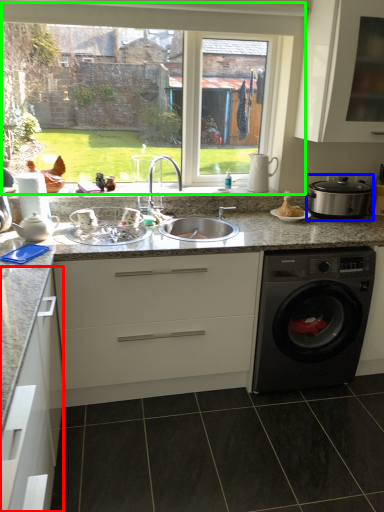
Question: Estimate the real-world distances between objects in this image. Which object is farther from cabinetry (highlighted by a red box), appliance (highlighted by a blue box) or window (highlighted by a green box)?

Choices:
 (A) appliance
 (B) window

Answer: (A)